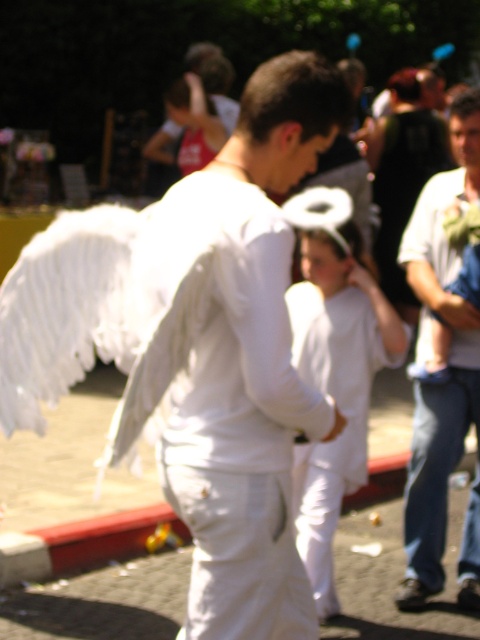
Is white cotton shirt at center positioned before black fabric hair at upper center?

Yes, it is.

Is white cotton shirt at center below black fabric hair at upper center?

Yes, white cotton shirt at center is below black fabric hair at upper center.

Between point (404, 244) and point (385, 188), which one is positioned in front?

Point (404, 244) is in front.

Where is `white cotton shirt at center`? The height and width of the screenshot is (640, 480). white cotton shirt at center is located at coordinates (443, 372).

Is point (468, 396) positioned behind point (300, 365)?

Yes.

Is white cotton shirt at center further to camera compared to white matte/soft robe at center?

Yes.

Between point (428, 500) and point (372, 369), which one is positioned in front?

Point (372, 369) is more forward.

At what (x,y) coordinates should I click in order to perform the action: click on white cotton shirt at center. Please return your answer as a coordinate pair (x, y). The height and width of the screenshot is (640, 480). Looking at the image, I should click on (443, 372).

Can you confirm if white matte wings at center is shorter than white cotton shirt at center?

Yes.

Is white matte wings at center bigger than white cotton shirt at center?

No, white matte wings at center is not bigger than white cotton shirt at center.

Who is more forward, (176, 291) or (471, 342)?

Positioned in front is point (176, 291).

Identify the location of white matte wings at center. This screenshot has height=640, width=480. (223, 400).